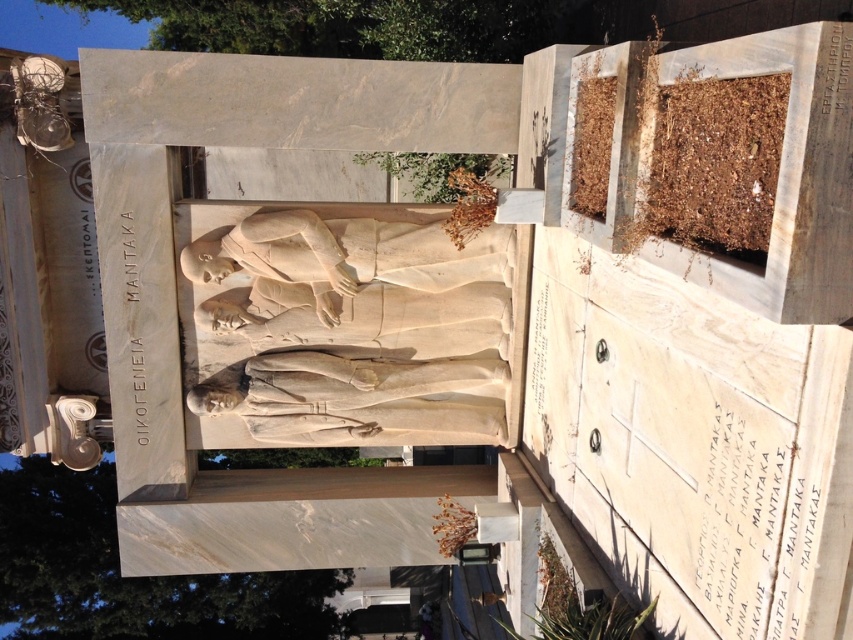
Can you confirm if black marble inscription at lower right is thinner than white marble text at center-left?

Yes.

Which is more to the left, black marble inscription at lower right or white marble text at center-left?

Positioned to the left is white marble text at center-left.

Find the location of a particular element. black marble inscription at lower right is located at coordinates (741, 518).

Is white marble statue at center shorter than black marble inscription at lower right?

In fact, white marble statue at center may be taller than black marble inscription at lower right.

Who is more forward, (376, 404) or (706, 467)?

Point (706, 467)

What are the coordinates of `white marble statue at center` in the screenshot? It's located at (354, 326).

Does white marble statue at center lie behind white marble text at center-left?

No, white marble statue at center is closer to the viewer.

Locate an element on the screen. The width and height of the screenshot is (853, 640). white marble statue at center is located at coordinates (354, 326).

The image size is (853, 640). What are the coordinates of `white marble statue at center` in the screenshot? It's located at (354, 326).